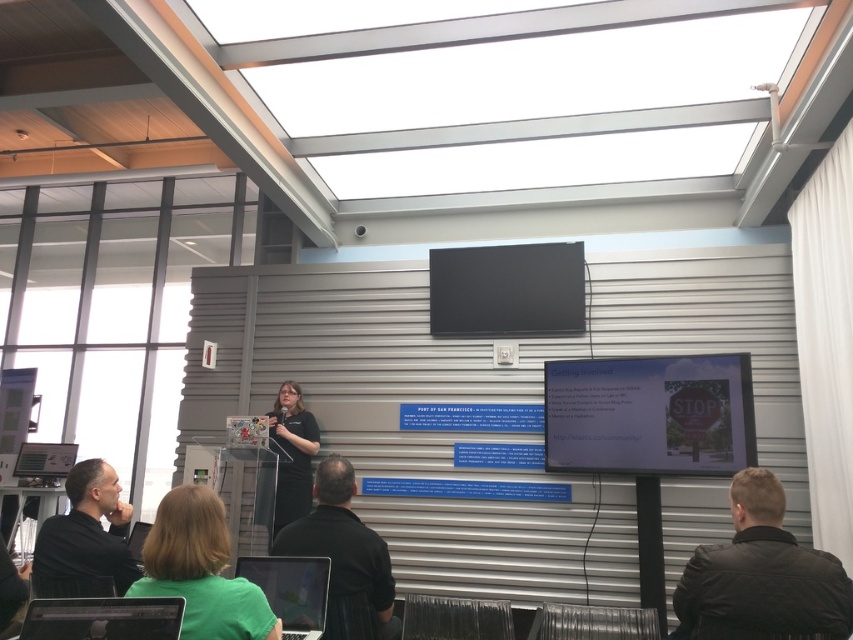
Question: Which point is farther to the camera?

Choices:
 (A) (102, 468)
 (B) (287, 632)
 (C) (729, 573)

Answer: (A)

Question: Considering the real-world distances, which object is farthest from the green matte shirt at lower center?

Choices:
 (A) black matte shirt at lower left
 (B) matte white projection screen at center
 (C) black leather jacket at lower right

Answer: (B)

Question: Can you confirm if matte black laptop at lower left is bigger than black matte shirt at center?

Choices:
 (A) yes
 (B) no

Answer: (B)

Question: Observing the image, what is the correct spatial positioning of black leather jacket at lower right in reference to green matte shirt at lower center?

Choices:
 (A) right
 (B) left

Answer: (A)

Question: Observing the image, what is the correct spatial positioning of matte white projection screen at center in reference to matte black laptop at lower center?

Choices:
 (A) right
 (B) left

Answer: (A)

Question: Among these points, which one is farthest from the camera?

Choices:
 (A) (253, 563)
 (B) (335, 557)

Answer: (B)